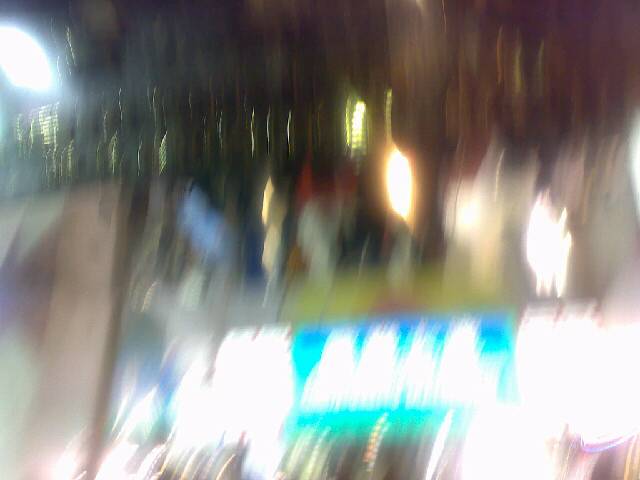
Where is `wooden pillar`? wooden pillar is located at coordinates (84, 319).